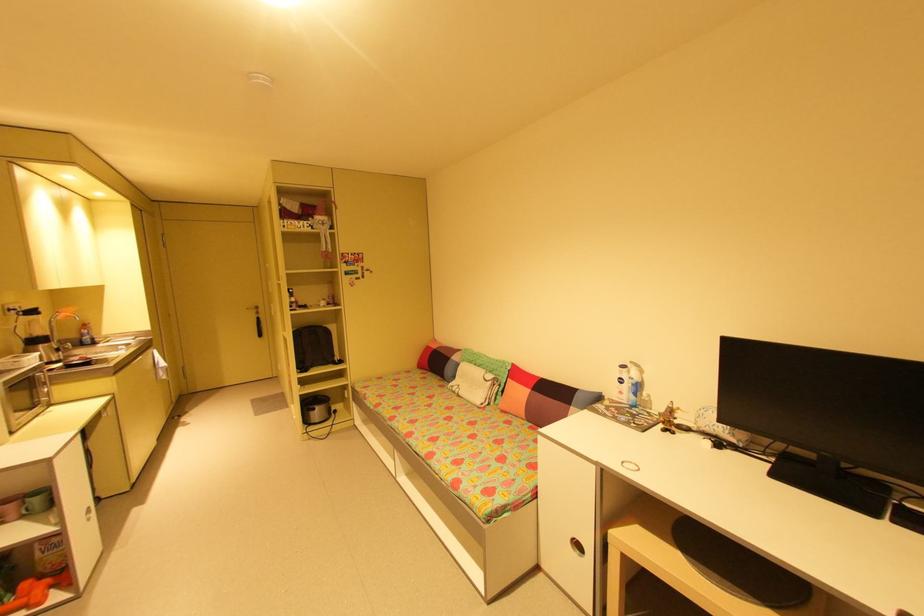
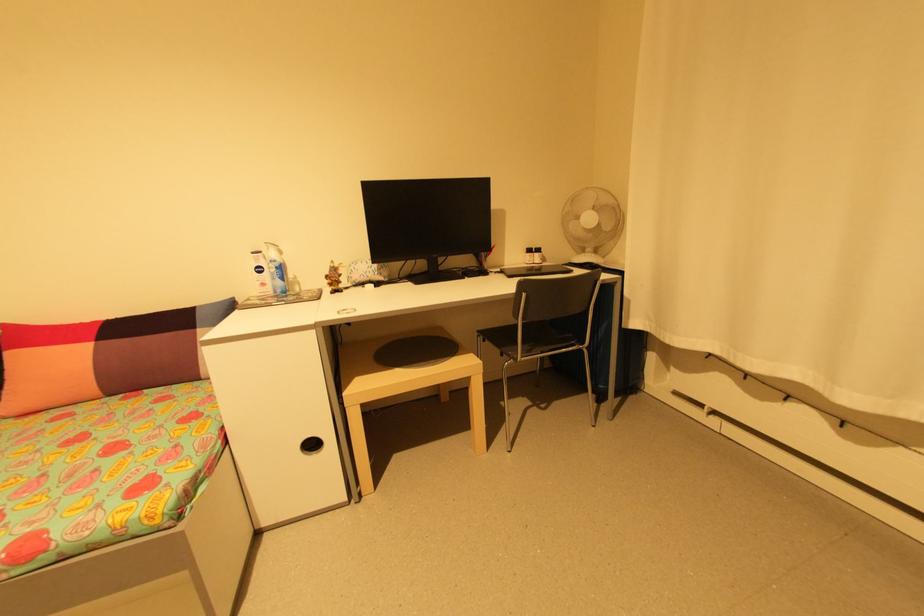
Where in the second image is the point corresponding to [582,546] from the first image?

(317, 446)